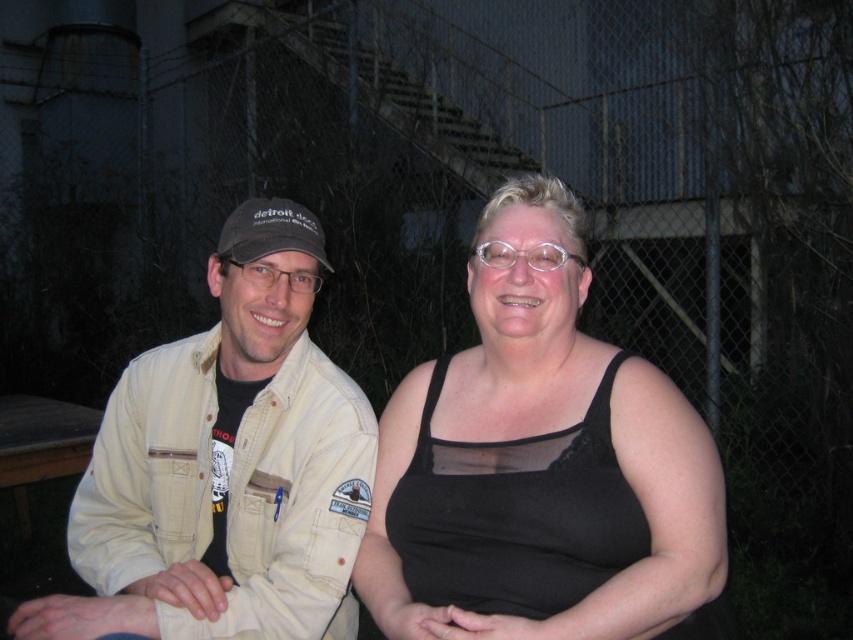
Question: Considering the real-world distances, which object is farthest from the dark gray fabric baseball cap at left?

Choices:
 (A) black sheer tank top at center
 (B) beige cotton jacket at left

Answer: (A)

Question: Which point is closer to the camera?

Choices:
 (A) beige cotton jacket at left
 (B) dark gray fabric baseball cap at left

Answer: (A)

Question: Does black sheer tank top at center appear on the left side of beige cotton jacket at left?

Choices:
 (A) yes
 (B) no

Answer: (B)

Question: Which object is positioned farthest from the black sheer tank top at center?

Choices:
 (A) beige cotton jacket at left
 (B) dark gray fabric baseball cap at left

Answer: (B)

Question: Is black sheer tank top at center closer to the viewer compared to dark gray fabric baseball cap at left?

Choices:
 (A) no
 (B) yes

Answer: (B)

Question: Can you confirm if beige cotton jacket at left is positioned below dark gray fabric baseball cap at left?

Choices:
 (A) no
 (B) yes

Answer: (B)